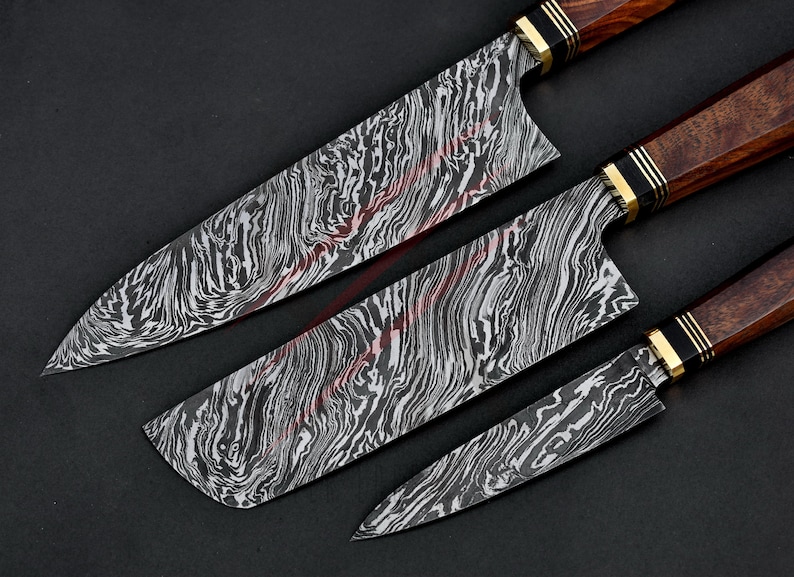
Locate an element on the screen. This screenshot has width=794, height=577. wood grain is located at coordinates (764, 306), (762, 88), (622, 20), (579, 5).